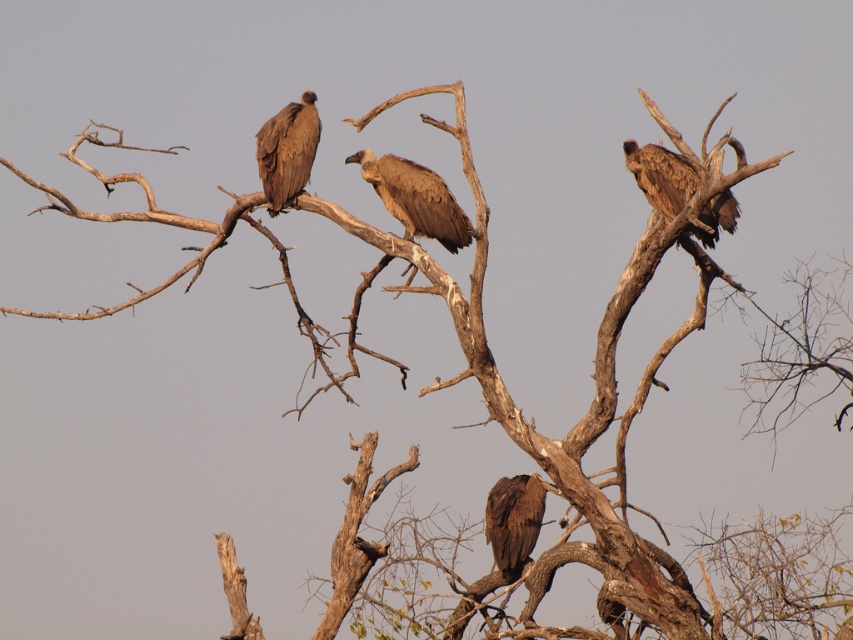
Question: Considering the real-world distances, which object is closest to the brown feathered eagle at lower center?

Choices:
 (A) brown feathered eagle at upper right
 (B) brown feathered vulture at upper left
 (C) brown feathered eagle at center

Answer: (C)

Question: Does brown feathered eagle at center appear under brown feathered eagle at lower center?

Choices:
 (A) yes
 (B) no

Answer: (B)

Question: Which point is closer to the camera taking this photo?

Choices:
 (A) (676, 211)
 (B) (277, 177)

Answer: (A)

Question: Is brown feathered vulture at upper left above brown feathered eagle at lower center?

Choices:
 (A) no
 (B) yes

Answer: (B)

Question: Which object is the closest to the brown feathered vulture at upper left?

Choices:
 (A) brown feathered eagle at lower center
 (B) brown feathered eagle at upper right
 (C) brown feathered eagle at center

Answer: (C)

Question: Is brown feathered eagle at center smaller than brown feathered eagle at lower center?

Choices:
 (A) no
 (B) yes

Answer: (A)